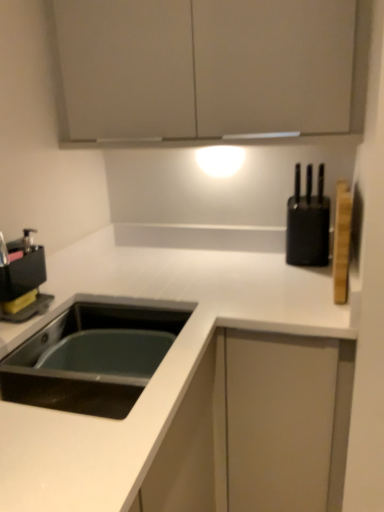
Question: Is black plastic coffee machine at left spatially inside matte white cabinet at upper center, or outside of it?

Choices:
 (A) inside
 (B) outside

Answer: (B)

Question: From a real-world perspective, relative to matte white cabinet at upper center, is black plastic coffee machine at left vertically above or below?

Choices:
 (A) below
 (B) above

Answer: (A)

Question: Estimate the real-world distances between objects in this image. Which object is closer to the black matte sink at lower left?

Choices:
 (A) black matte knife block at right
 (B) white matte countertop at lower left
 (C) black plastic coffee machine at left
 (D) matte white cabinet at upper center

Answer: (B)

Question: Estimate the real-world distances between objects in this image. Which object is closer to the black matte sink at lower left?

Choices:
 (A) black plastic coffee machine at left
 (B) white matte countertop at lower left
 (C) black matte knife block at right
 (D) matte white cabinet at upper center

Answer: (B)